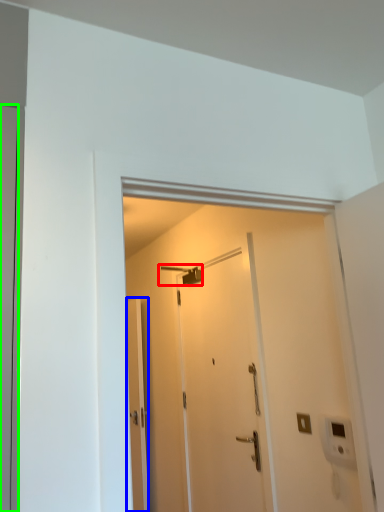
Question: Which is farther away from shower (highlighted by a red box)? door (highlighted by a blue box) or door (highlighted by a green box)?

Choices:
 (A) door
 (B) door

Answer: (B)